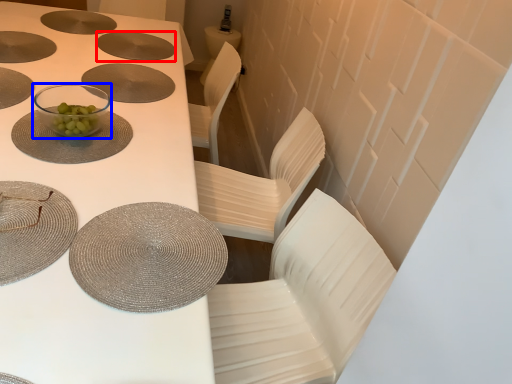
Question: Which object is further to the camera taking this photo, tableware (highlighted by a red box) or tableware (highlighted by a blue box)?

Choices:
 (A) tableware
 (B) tableware

Answer: (A)